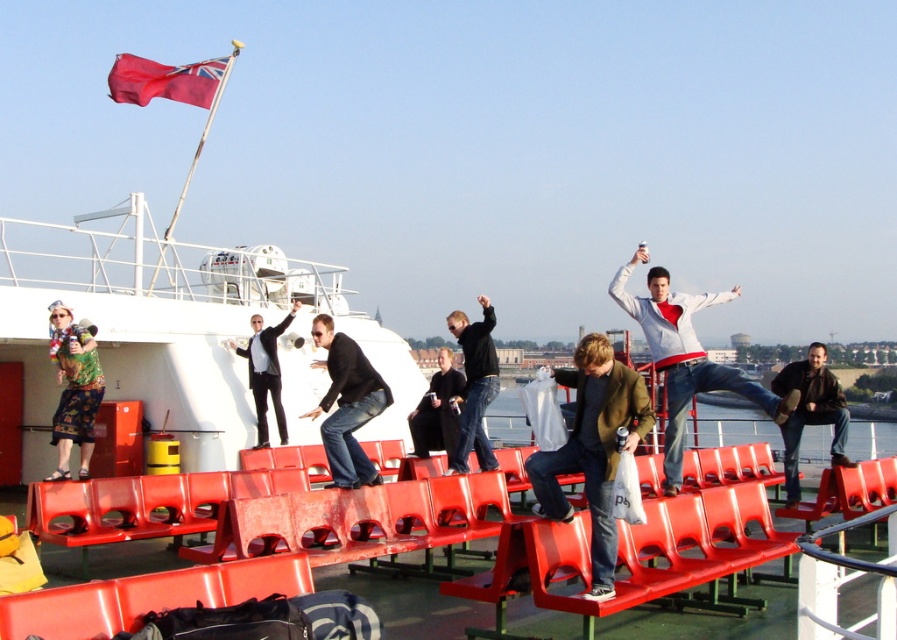
Question: Considering the real-world distances, which object is farthest from the black smooth suit at center?

Choices:
 (A) black matte jeans at center
 (B) red fabric flag at upper left

Answer: (B)

Question: In this image, where is black leather jacket at center located relative to red fabric flag at upper left?

Choices:
 (A) above
 (B) below

Answer: (B)

Question: Which is farther from the white matte jacket at upper center?

Choices:
 (A) brown leather jacket at center
 (B) red fabric flag at upper left

Answer: (B)

Question: Does printed fabric dress at upper left appear over black leather jacket at center?

Choices:
 (A) yes
 (B) no

Answer: (B)

Question: Which object is closer to the camera taking this photo?

Choices:
 (A) brown leather jacket at center
 (B) matte brown jacket at center
 (C) red fabric flag at upper left

Answer: (B)

Question: Is matte brown jacket at center to the left of white matte jacket at upper center from the viewer's perspective?

Choices:
 (A) yes
 (B) no

Answer: (A)